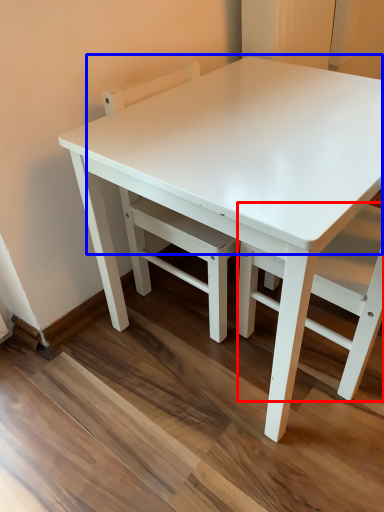
Question: Among these objects, which one is farthest to the camera, chair (highlighted by a red box) or table top (highlighted by a blue box)?

Choices:
 (A) chair
 (B) table top

Answer: (B)